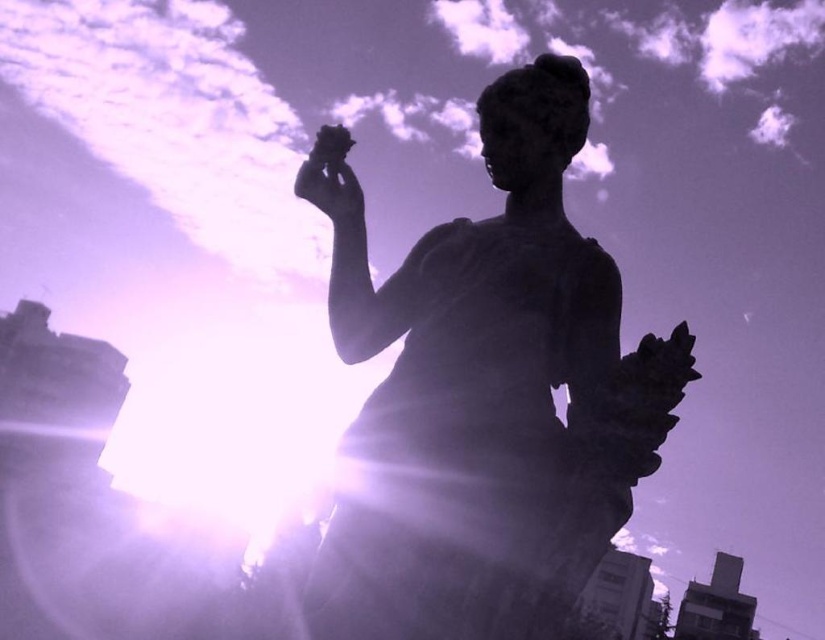
In the scene shown: You are an art conservator examining the statue from the front. You notice the matte black hand at upper center and the sculpted stone statue at center. Which object is positioned closer to your viewpoint?

The sculpted stone statue at center is closer to the viewer than the matte black hand at upper center.

You are an art student analyzing the statue in the image. You notice the sculpted stone statue at center and the matte black hand at upper center. Which object is taller?

The sculpted stone statue at center is much taller as matte black hand at upper center.